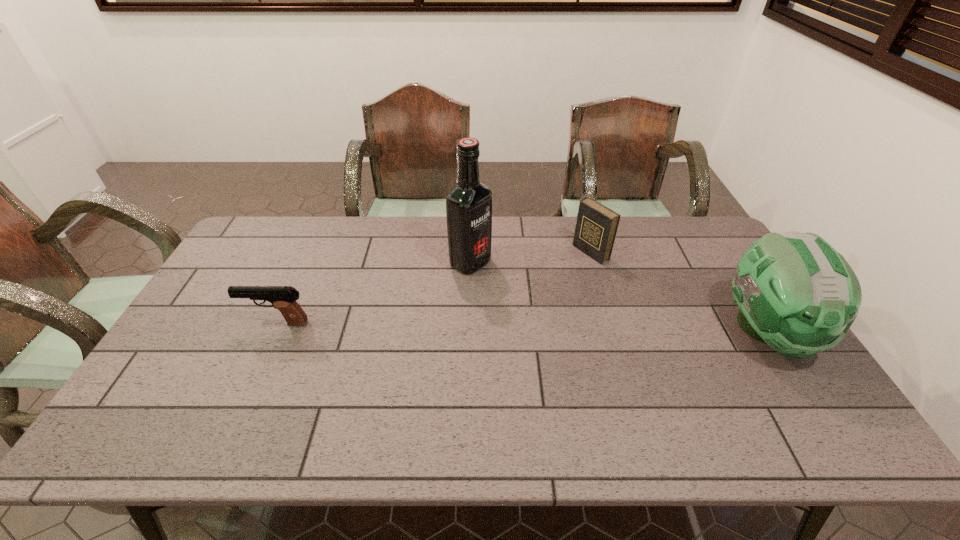
Locate an element on the screen. free location located 0.080m at the barrel of the shortest object is located at coordinates (217, 323).

The width and height of the screenshot is (960, 540). What are the coordinates of `free space located 0.250m on the front cover of the diary` in the screenshot? It's located at (522, 291).

The width and height of the screenshot is (960, 540). I want to click on free spot located on the front cover of the diary, so pos(510,298).

You are a GUI agent. You are given a task and a screenshot of the screen. Output one action in this format:
    pyautogui.click(x=<x>, y=<y>)
    Task: Click on the free location located 0.110m on the front cover of the diary
    
    Given the screenshot: What is the action you would take?
    click(x=556, y=273)

At what (x,y) coordinates should I click in order to perform the action: click on free space located 0.170m on the front-facing side of the third object from right to left. Please return your answer as a coordinate pair (x, y). Looking at the image, I should click on tap(529, 296).

The height and width of the screenshot is (540, 960). Identify the location of vacant position located 0.170m on the front-facing side of the third object from right to left. (529, 296).

In order to click on free space located on the front-facing side of the third object from right to left in this screenshot , I will do `click(535, 299)`.

Where is `diary present at the far edge`? This screenshot has height=540, width=960. diary present at the far edge is located at coordinates (596, 226).

The height and width of the screenshot is (540, 960). Identify the location of liquor present at the far edge. (469, 204).

Locate an element on the screen. The image size is (960, 540). object present at the left edge is located at coordinates point(283,298).